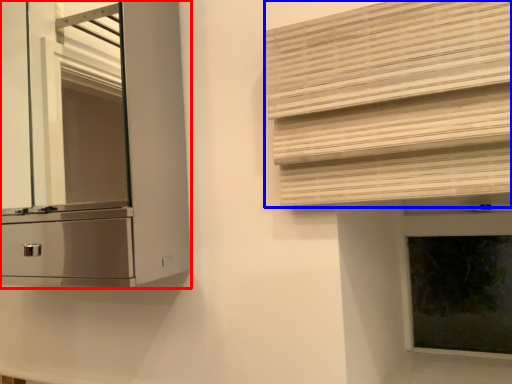
Question: Which object is closer to the camera taking this photo, cabinetry (highlighted by a red box) or shutter (highlighted by a blue box)?

Choices:
 (A) cabinetry
 (B) shutter

Answer: (B)